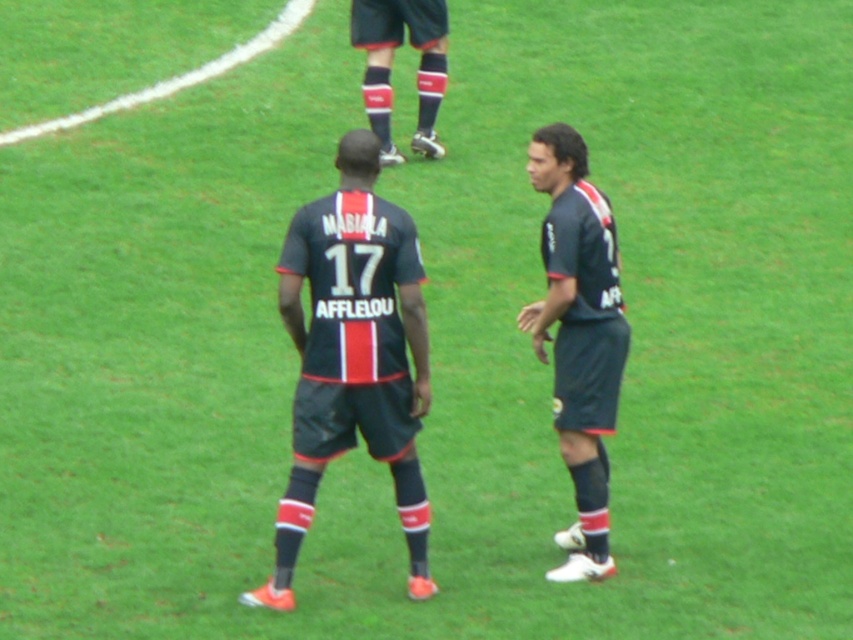
Question: Which object appears farthest from the camera in this image?

Choices:
 (A) matte black socks at upper center
 (B) dark blue jersey at center
 (C) matte dark blue jersey at right

Answer: (A)

Question: Which object appears farthest from the camera in this image?

Choices:
 (A) dark blue jersey at center
 (B) matte black socks at upper center

Answer: (B)

Question: Observing the image, what is the correct spatial positioning of dark blue jersey at center in reference to matte dark blue jersey at right?

Choices:
 (A) above
 (B) below

Answer: (B)

Question: In this image, where is matte dark blue jersey at right located relative to matte black socks at upper center?

Choices:
 (A) right
 (B) left

Answer: (A)

Question: Which point is farther from the camera taking this photo?

Choices:
 (A) (444, 36)
 (B) (315, 390)

Answer: (A)

Question: Does matte dark blue jersey at right have a smaller size compared to matte black socks at upper center?

Choices:
 (A) yes
 (B) no

Answer: (B)